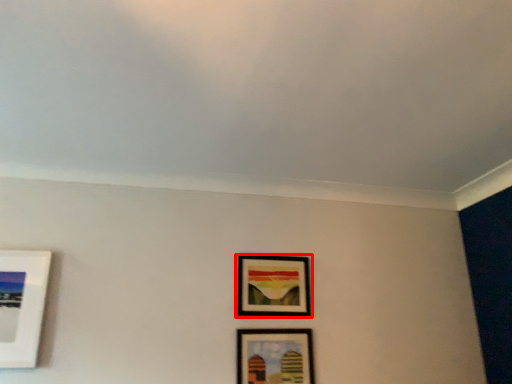
Question: Observing the image, what is the correct spatial positioning of picture frame (annotated by the red box) in reference to picture frame?

Choices:
 (A) left
 (B) right

Answer: (A)